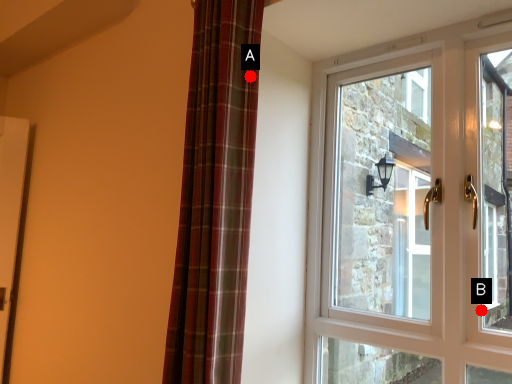
Question: Two points are circled on the image, labeled by A and B beside each circle. Which point is closer to the camera?

Choices:
 (A) A is closer
 (B) B is closer

Answer: (A)